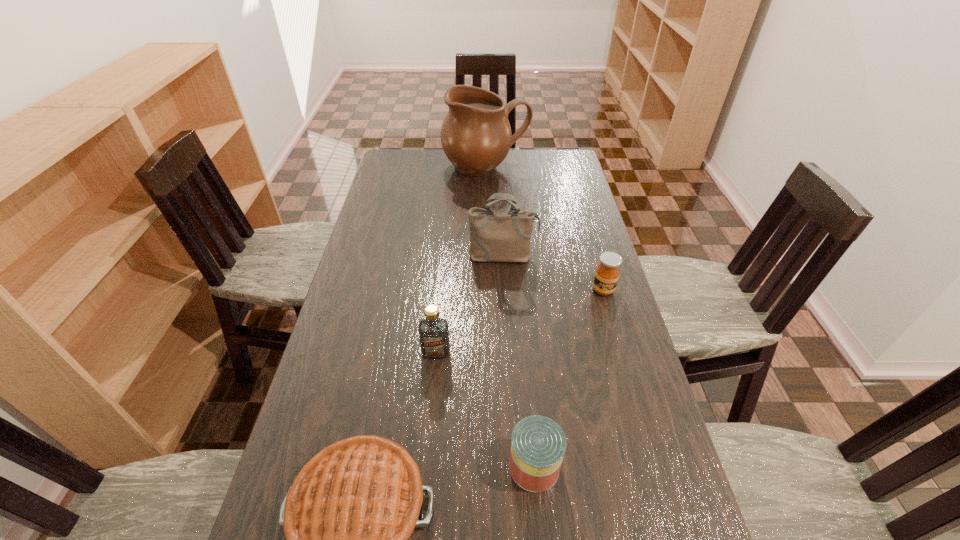
Locate an element on the screen. This screenshot has width=960, height=540. the farthest object is located at coordinates (476, 136).

At what (x,y) coordinates should I click in order to perform the action: click on the tallest object. Please return your answer as a coordinate pair (x, y). The image size is (960, 540). Looking at the image, I should click on (476, 136).

The image size is (960, 540). Find the location of `the fifth nearest object`. the fifth nearest object is located at coordinates (495, 236).

At what (x,y) coordinates should I click in order to perform the action: click on the second tallest object. Please return your answer as a coordinate pair (x, y). The height and width of the screenshot is (540, 960). Looking at the image, I should click on (495, 236).

Find the location of a particular element. The height and width of the screenshot is (540, 960). the fourth farthest object is located at coordinates (433, 331).

Image resolution: width=960 pixels, height=540 pixels. Find the location of `the fourth shortest object`. the fourth shortest object is located at coordinates (433, 331).

Locate an element on the screen. The image size is (960, 540). honey is located at coordinates (607, 273).

This screenshot has height=540, width=960. I want to click on the rightmost object, so click(x=607, y=273).

Locate an element on the screen. can is located at coordinates click(538, 444).

Identify the location of blank space located at the spout of the farthest object. (488, 222).